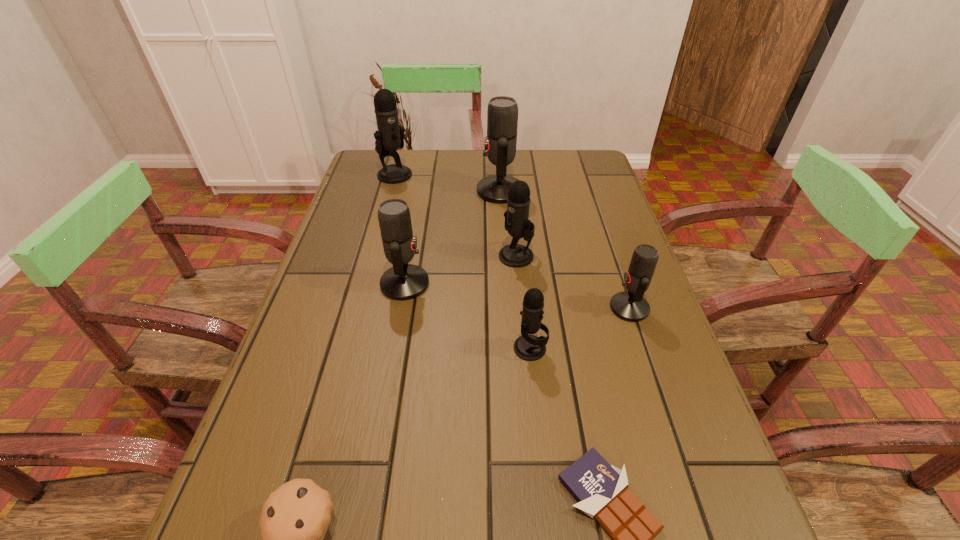
Locate an element on the screen. The height and width of the screenshot is (540, 960). free area in between the farthest red microphone and the nearest microphone is located at coordinates pos(515,269).

Identify the location of blank region between the farthest black microphone and the smallest black microphone. This screenshot has width=960, height=540. (463, 261).

Find the location of a particular element. free space that is in between the biggest black microphone and the sixth farthest object is located at coordinates (463, 261).

I want to click on the second closest object to the rightmost microphone, so click(x=517, y=224).

Identify the location of the sixth closest object relative to the biggest black microphone. (601, 489).

Choose which microphone is the fourth nearest neighbor to the muffin. Please provide its 2D coordinates. Your answer should be formatted as a tuple, i.e. [(x, y)], where the tuple contains the x and y coordinates of a point satisfying the conditions above.

[(631, 306)]

This screenshot has height=540, width=960. In order to click on microphone that stands as the closest to the farthest black microphone in this screenshot , I will do `click(502, 114)`.

Identify the location of red microphone that stands as the second closest to the seventh tallest object. [x=631, y=306].

Choose which red microphone is the second nearest neighbor to the farthest red microphone. Please provide its 2D coordinates. Your answer should be formatted as a tuple, i.e. [(x, y)], where the tuple contains the x and y coordinates of a point satisfying the conditions above.

[(631, 306)]

Locate an element on the screen. Image resolution: width=960 pixels, height=540 pixels. black microphone that can be found as the closest to the biggest black microphone is located at coordinates (517, 224).